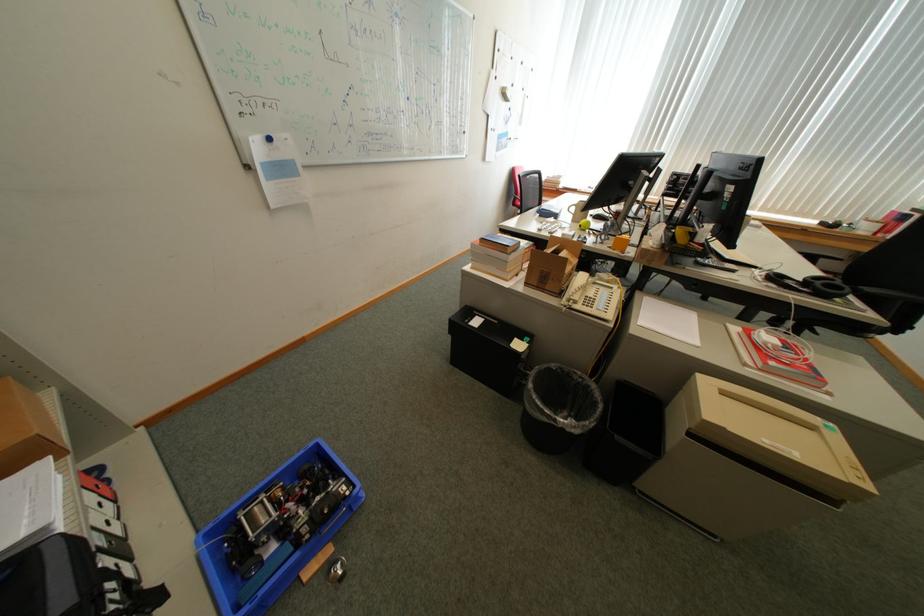
Where is `beige telephone handset`? Image resolution: width=924 pixels, height=616 pixels. beige telephone handset is located at coordinates (574, 288).